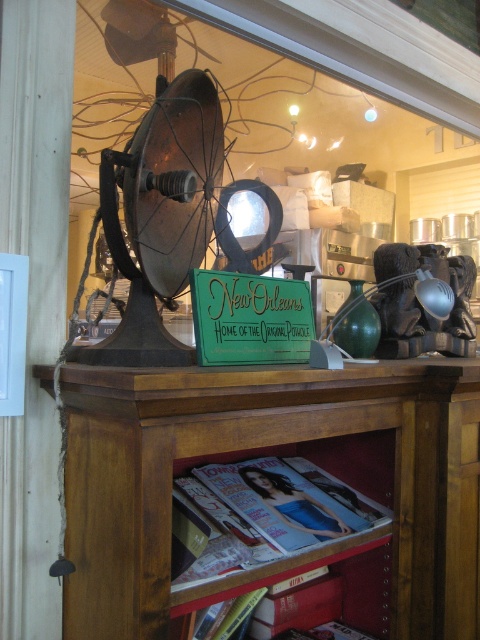
Question: Does matte paper magazine at lower center lie behind green wood sign at center?

Choices:
 (A) yes
 (B) no

Answer: (B)

Question: Where is metallic globe at upper center located in relation to green wood sign at center in the image?

Choices:
 (A) right
 (B) left

Answer: (A)

Question: Estimate the real-world distances between objects in this image. Which object is closer to the wooden bookshelf at center?

Choices:
 (A) matte paper magazine at lower center
 (B) green wood sign at center

Answer: (A)

Question: Considering the real-world distances, which object is farthest from the matte paper magazine at lower center?

Choices:
 (A) metallic globe at upper center
 (B) wooden bookshelf at center

Answer: (A)

Question: Observing the image, what is the correct spatial positioning of wooden bookshelf at center in reference to green wood sign at center?

Choices:
 (A) right
 (B) left

Answer: (A)

Question: Which point is farther to the camera?

Choices:
 (A) (222, 296)
 (B) (229, 499)

Answer: (B)